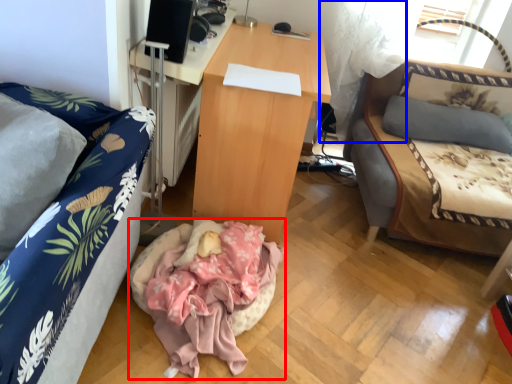
Question: Which object appears farthest to the camera in this image, infant bed (highlighted by a red box) or curtain (highlighted by a blue box)?

Choices:
 (A) infant bed
 (B) curtain

Answer: (B)